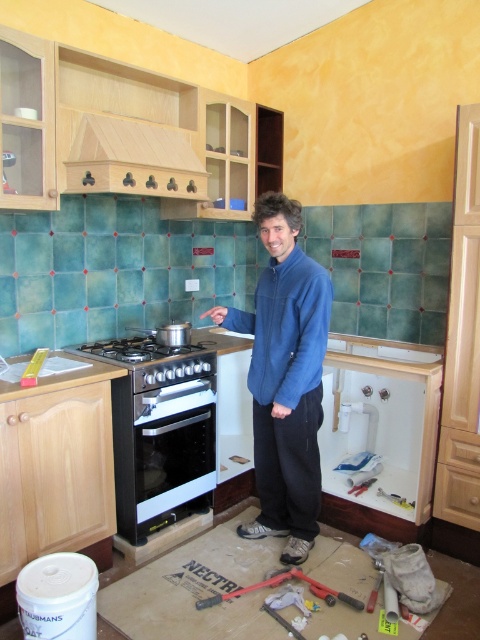
Question: Is black glossy oven at center bigger than brushed metal hammer at lower center?

Choices:
 (A) yes
 (B) no

Answer: (A)

Question: Does blue fleece jacket at center appear on the right side of brushed metal hammer at lower center?

Choices:
 (A) no
 (B) yes

Answer: (B)

Question: Among these points, which one is farthest from the camera?

Choices:
 (A) (101, 147)
 (B) (261, 404)
 (C) (121, 342)

Answer: (C)

Question: Which of the following is the closest to the observer?

Choices:
 (A) (117, 468)
 (B) (367, 486)
 (C) (152, 349)

Answer: (A)

Question: Estimate the real-world distances between objects in this image. Which object is closer to the blue fleece jacket at center?

Choices:
 (A) metallic silver wrench at lower center
 (B) black matte gas stove at center

Answer: (B)

Question: Can you confirm if blue fleece jacket at center is bigger than black glossy oven at center?

Choices:
 (A) no
 (B) yes

Answer: (B)